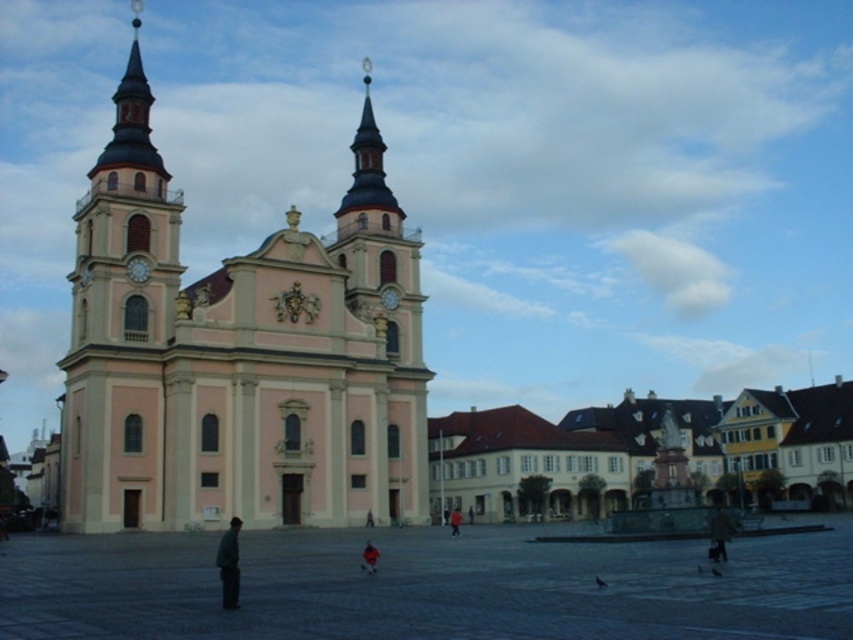
Question: Can you confirm if dark gray stone square at center is positioned above smooth pink tower at left?

Choices:
 (A) yes
 (B) no

Answer: (B)

Question: Is pink smooth church at center wider than dark gray jacket at center?

Choices:
 (A) no
 (B) yes

Answer: (B)

Question: Estimate the real-world distances between objects in this image. Which object is farther from the red fabric jacket at center?

Choices:
 (A) dark gray stone square at center
 (B) dark gray jacket at lower left
 (C) pink smooth church at center
 (D) dark gray jacket at center

Answer: (B)

Question: Which point appears farthest from the camera in this image?

Choices:
 (A) (563, 493)
 (B) (108, 204)

Answer: (A)

Question: Which object is positioned closest to the red fabric jacket at center?

Choices:
 (A) smooth pink tower at left
 (B) brown/brick buildings at lower right

Answer: (B)

Question: Is brown/brick buildings at lower right thinner than dark gray jacket at center?

Choices:
 (A) yes
 (B) no

Answer: (B)